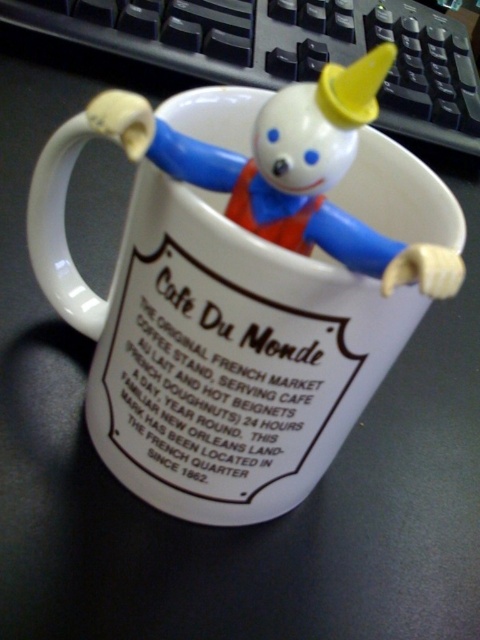
Question: Among these objects, which one is farthest from the camera?

Choices:
 (A) black plastic keyboard at upper center
 (B) white ceramic mug at center

Answer: (A)

Question: From the image, what is the correct spatial relationship of black plastic keyboard at upper center in relation to plastic toy at upper center?

Choices:
 (A) right
 (B) left

Answer: (B)

Question: Which of these objects is positioned closest to the plastic toy at upper center?

Choices:
 (A) white ceramic mug at center
 (B) black plastic keyboard at upper center

Answer: (A)

Question: Which of the following is the closest to the observer?

Choices:
 (A) (404, 13)
 (B) (191, 252)

Answer: (B)

Question: Is the position of white ceramic mug at center less distant than that of plastic toy at upper center?

Choices:
 (A) no
 (B) yes

Answer: (A)

Question: Is white ceramic mug at center positioned at the back of black plastic keyboard at upper center?

Choices:
 (A) no
 (B) yes

Answer: (A)